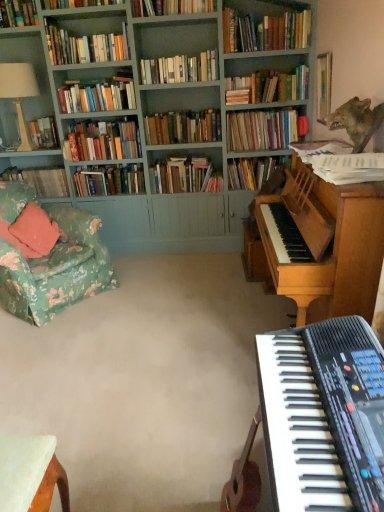
Question: Is shiny metallic wolf at upper right oriented towards teal painted wood bookcase at upper left?

Choices:
 (A) yes
 (B) no

Answer: (B)

Question: Is shiny metallic wolf at upper right not within teal painted wood bookcase at upper left?

Choices:
 (A) yes
 (B) no

Answer: (A)

Question: Considering the relative sizes of shiny metallic wolf at upper right and teal painted wood bookcase at upper left in the image provided, is shiny metallic wolf at upper right smaller than teal painted wood bookcase at upper left?

Choices:
 (A) no
 (B) yes

Answer: (B)

Question: Is shiny metallic wolf at upper right surrounding teal painted wood bookcase at upper left?

Choices:
 (A) yes
 (B) no

Answer: (B)

Question: Considering the relative sizes of shiny metallic wolf at upper right and teal painted wood bookcase at upper left in the image provided, is shiny metallic wolf at upper right taller than teal painted wood bookcase at upper left?

Choices:
 (A) yes
 (B) no

Answer: (B)

Question: From the image's perspective, is hardcover book at left, acting as the 14th book starting from the front, positioned above or below black plastic keyboard at lower right?

Choices:
 (A) above
 (B) below

Answer: (A)

Question: From a real-world perspective, is hardcover book at left, which ranks as the first book in back-to-front order, positioned above or below black plastic keyboard at lower right?

Choices:
 (A) above
 (B) below

Answer: (B)

Question: In terms of width, does hardcover book at left, acting as the 14th book starting from the front, look wider or thinner when compared to black plastic keyboard at lower right?

Choices:
 (A) wide
 (B) thin

Answer: (B)

Question: Looking at the image, does hardcover book at left, acting as the 14th book starting from the front, seem bigger or smaller compared to black plastic keyboard at lower right?

Choices:
 (A) small
 (B) big

Answer: (B)

Question: Looking at the image, does light brown polished wood piano at right seem bigger or smaller compared to hardcover books at upper center, which is the 13th book from back to front?

Choices:
 (A) small
 (B) big

Answer: (B)

Question: Choose the correct answer: Is light brown polished wood piano at right inside hardcover books at upper center, which is the 13th book from back to front, or outside it?

Choices:
 (A) outside
 (B) inside

Answer: (A)

Question: Considering the positions of light brown polished wood piano at right and hardcover books at upper center, which is the 13th book from back to front, in the image, is light brown polished wood piano at right wider or thinner than hardcover books at upper center, which is the 13th book from back to front,?

Choices:
 (A) wide
 (B) thin

Answer: (A)

Question: Is light brown polished wood piano at right in front of or behind hardcover books at upper center, which is the second book in front-to-back order, in the image?

Choices:
 (A) behind
 (B) front

Answer: (B)

Question: Relative to hardcover books at center, acting as the seventh book starting from the front, is teal painted wood bookcase at upper left in front or behind?

Choices:
 (A) behind
 (B) front

Answer: (B)

Question: From the image's perspective, relative to hardcover books at center, which appears as the 8th book when viewed from the back, is teal painted wood bookcase at upper left above or below?

Choices:
 (A) above
 (B) below

Answer: (A)